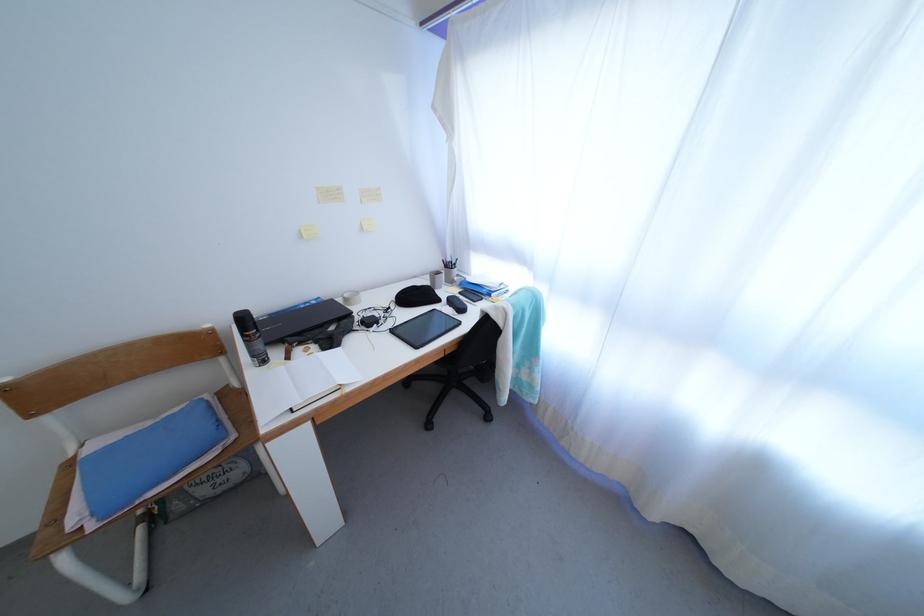
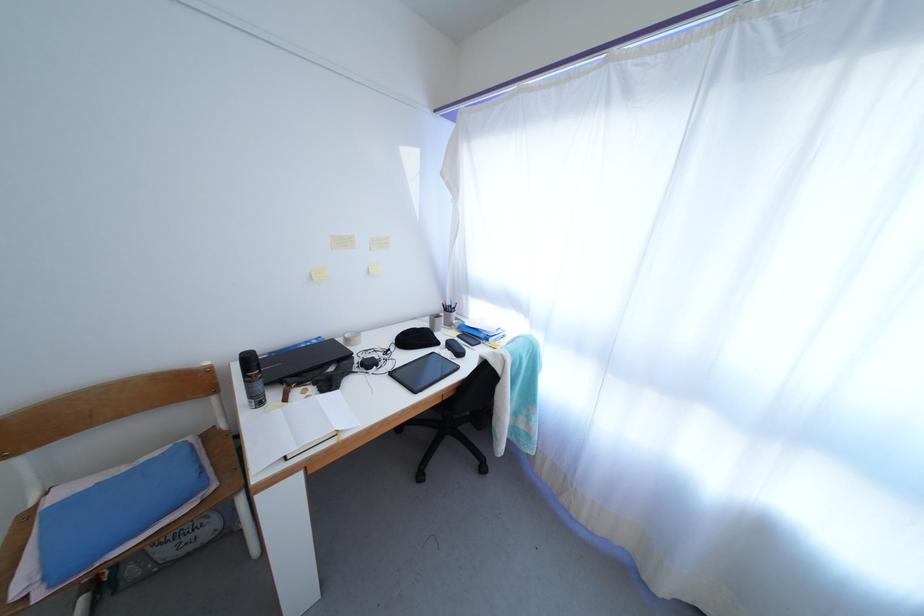
Find the pixel in the second image that matches the point at 444,278 in the first image.

(444, 322)